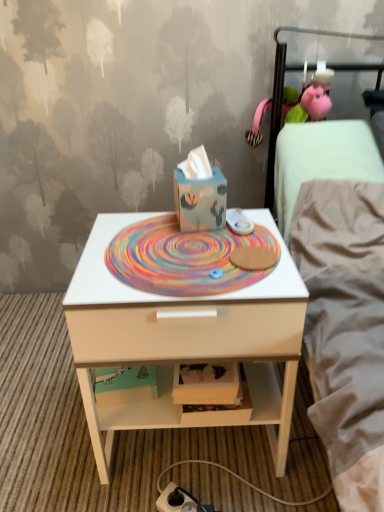
Image resolution: width=384 pixels, height=512 pixels. Find the location of `free location above white matte nightstand at center (from a real-world perspective)`. free location above white matte nightstand at center (from a real-world perspective) is located at coordinates pos(185,248).